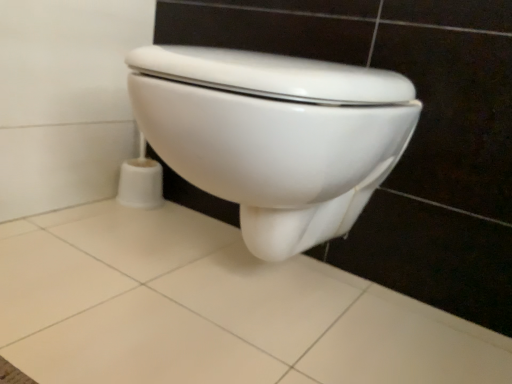
Measure the distance between white ceramic tile at lower center and camera.

A distance of 21.88 inches exists between white ceramic tile at lower center and camera.

Find the location of `white ceramic tile at lower center`. white ceramic tile at lower center is located at coordinates (211, 309).

What do you see at coordinates (211, 309) in the screenshot?
I see `white ceramic tile at lower center` at bounding box center [211, 309].

Describe the element at coordinates (274, 136) in the screenshot. I see `white glossy toilet at center` at that location.

This screenshot has width=512, height=384. What are the coordinates of `white glossy toilet at center` in the screenshot? It's located at (274, 136).

Locate an element on the screen. Image resolution: width=512 pixels, height=384 pixels. white ceramic tile at lower center is located at coordinates (211, 309).

Between white glossy toilet at center and white ceramic tile at lower center, which one appears on the right side from the viewer's perspective?

white glossy toilet at center is more to the right.

Which is in front, white glossy toilet at center or white ceramic tile at lower center?

white ceramic tile at lower center is closer to the camera.

Based on the photo, which is further, (x=176, y=165) or (x=395, y=328)?

Positioned behind is point (x=395, y=328).

From the image's perspective, which is below, white glossy toilet at center or white ceramic tile at lower center?

white ceramic tile at lower center, from the image's perspective.

From a real-world perspective, who is located lower, white glossy toilet at center or white ceramic tile at lower center?

white ceramic tile at lower center is physically lower.

Between white glossy toilet at center and white ceramic tile at lower center, which one has larger width?

With larger width is white ceramic tile at lower center.

Is white glossy toilet at center shorter than white ceramic tile at lower center?

Incorrect, the height of white glossy toilet at center does not fall short of that of white ceramic tile at lower center.

Which of these two, white glossy toilet at center or white ceramic tile at lower center, is bigger?

white glossy toilet at center is bigger.

Is white glossy toilet at center inside or outside of white ceramic tile at lower center?

white glossy toilet at center is not enclosed by white ceramic tile at lower center.

Is white glossy toilet at center far away from white ceramic tile at lower center?

white glossy toilet at center is actually quite close to white ceramic tile at lower center.

Is white glossy toilet at center facing towards white ceramic tile at lower center?

No, white glossy toilet at center does not turn towards white ceramic tile at lower center.

From the picture: How many degrees apart are the facing directions of white glossy toilet at center and white ceramic tile at lower center?

They differ by 90.4 degrees in their facing directions.

Locate an element on the screen. The height and width of the screenshot is (384, 512). ceramic tile that is in front of the white glossy toilet at center is located at coordinates (211, 309).

Is white ceramic tile at lower center to the right of white glossy toilet at center from the viewer's perspective?

No, white ceramic tile at lower center is not to the right of white glossy toilet at center.

Is white ceramic tile at lower center behind white glossy toilet at center?

No, white ceramic tile at lower center is closer to the camera.

Which is nearer, (x=385, y=305) or (x=314, y=136)?

Point (x=385, y=305).

Based on the photo, from the image's perspective, which one is positioned lower, white ceramic tile at lower center or white glossy toilet at center?

white ceramic tile at lower center, from the image's perspective.

From a real-world perspective, is white ceramic tile at lower center located higher than white glossy toilet at center?

No, from a real-world perspective, white ceramic tile at lower center is not above white glossy toilet at center.

Can you confirm if white ceramic tile at lower center is wider than white glossy toilet at center?

Yes.

Between white ceramic tile at lower center and white glossy toilet at center, which one has more height?

white glossy toilet at center.

Consider the image. Does white ceramic tile at lower center have a larger size compared to white glossy toilet at center?

Actually, white ceramic tile at lower center might be smaller than white glossy toilet at center.

Is white ceramic tile at lower center not inside white glossy toilet at center?

Absolutely, white ceramic tile at lower center is external to white glossy toilet at center.

Are white ceramic tile at lower center and white glossy toilet at center located far from each other?

That's not correct — white ceramic tile at lower center is a little close to white glossy toilet at center.

Is white ceramic tile at lower center turned away from white glossy toilet at center?

white ceramic tile at lower center is not turned away from white glossy toilet at center.

What's the angular difference between white ceramic tile at lower center and white glossy toilet at center's facing directions?

The angular difference between white ceramic tile at lower center and white glossy toilet at center is 90.4 degrees.

The image size is (512, 384). In order to click on toilet above the white ceramic tile at lower center (from a real-world perspective) in this screenshot , I will do `click(274, 136)`.

Identify the location of toilet that appears on the right of white ceramic tile at lower center. (274, 136).

Find the location of a particular element. The image size is (512, 384). toilet above the white ceramic tile at lower center (from the image's perspective) is located at coordinates (274, 136).